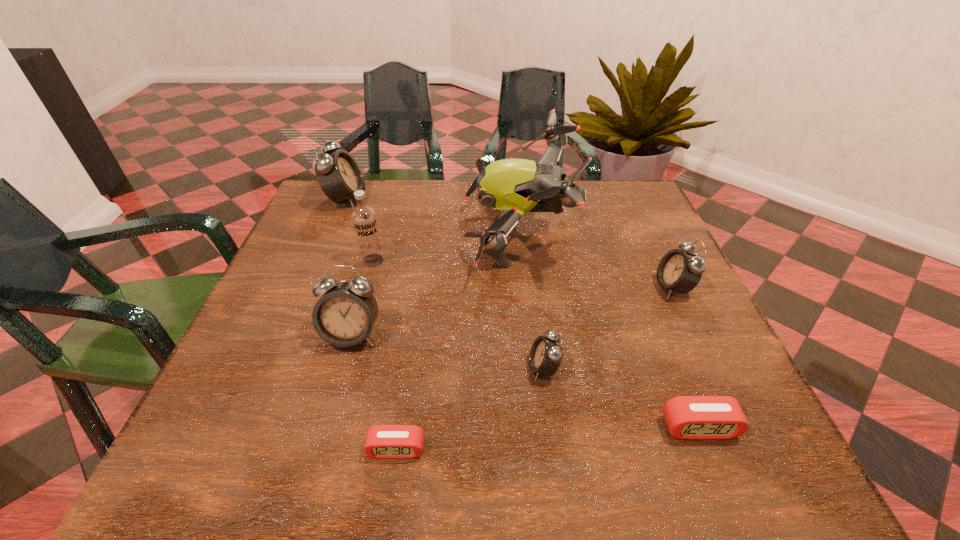
Find the location of a particular element. Image resolution: width=960 pixels, height=540 pixels. free point between the leftmost alarm clock and the fourth alarm clock from left to right is located at coordinates (444, 284).

Identify the location of free point between the fourth shortest alarm clock and the vodka. The width and height of the screenshot is (960, 540). (523, 274).

I want to click on free spot between the third tallest alarm clock and the tallest object, so click(x=595, y=259).

In order to click on free area in between the third shortest alarm clock and the second tallest alarm clock in this screenshot , I will do `click(447, 352)`.

The image size is (960, 540). Identify the location of free spot between the second farthest alarm clock and the drone. (595, 259).

Locate an element on the screen. vacant region between the leftmost white alarm clock and the second alarm clock from left to right is located at coordinates (349, 268).

The width and height of the screenshot is (960, 540). Find the location of `empty location between the fifth shortest alarm clock and the right pink alarm clock`. empty location between the fifth shortest alarm clock and the right pink alarm clock is located at coordinates (525, 381).

Locate an element on the screen. This screenshot has width=960, height=540. object that stands as the sixth closest to the vodka is located at coordinates (680, 271).

This screenshot has height=540, width=960. I want to click on object that is the fifth closest one to the smallest white alarm clock, so click(344, 315).

Identify the location of alarm clock that is the closest to the leftmost white alarm clock. This screenshot has height=540, width=960. (344, 315).